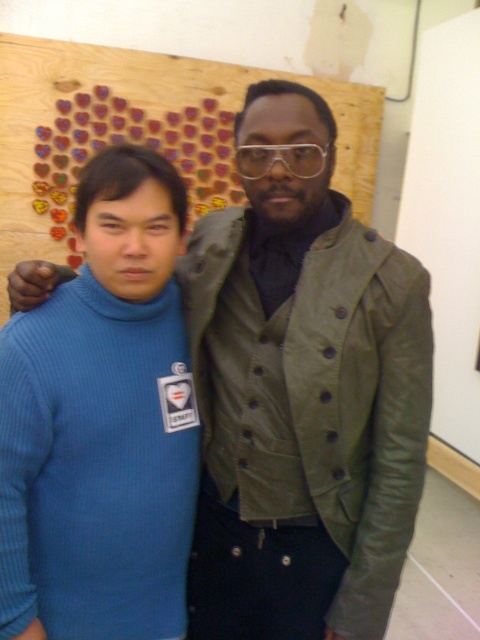
Question: Does matte green leather vest at center appear on the left side of blue ribbed sweater at left?

Choices:
 (A) yes
 (B) no

Answer: (B)

Question: Which object is closer to the camera taking this photo?

Choices:
 (A) matte green leather vest at center
 (B) blue ribbed sweater at left

Answer: (B)

Question: Can you confirm if matte green leather vest at center is smaller than blue ribbed sweater at left?

Choices:
 (A) yes
 (B) no

Answer: (B)

Question: Does matte green leather vest at center lie behind blue ribbed sweater at left?

Choices:
 (A) yes
 (B) no

Answer: (A)

Question: Among these objects, which one is nearest to the camera?

Choices:
 (A) matte green leather vest at center
 (B) blue ribbed sweater at left

Answer: (B)